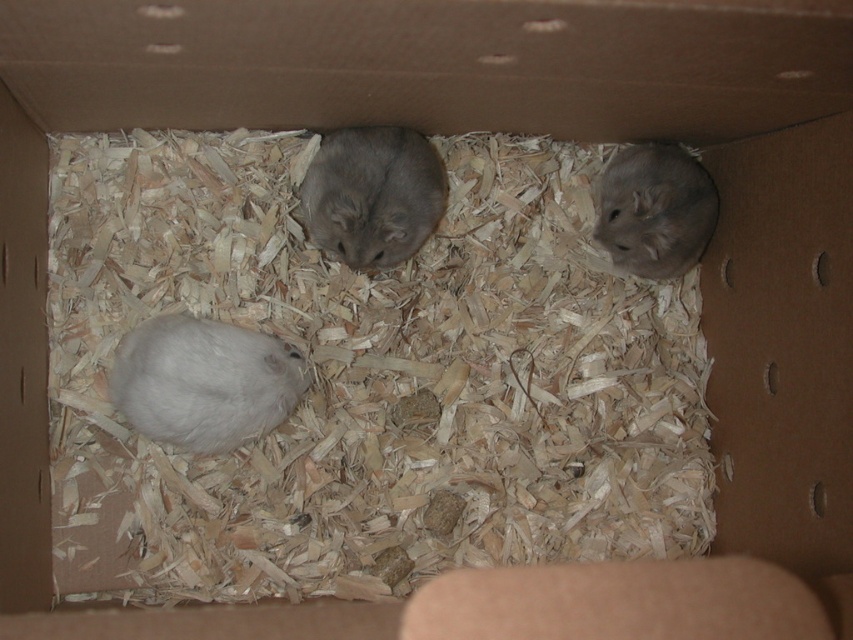
Measure the distance between white fluffy mouse at lower left and camera.

The distance of white fluffy mouse at lower left from camera is 3.87 feet.

Can you confirm if white fluffy mouse at lower left is taller than gray soft fur hamster at center?

Incorrect, white fluffy mouse at lower left's height is not larger of gray soft fur hamster at center's.

Does point (195, 365) come closer to viewer compared to point (339, 205)?

Yes, point (195, 365) is in front of point (339, 205).

In order to click on white fluffy mouse at lower left in this screenshot , I will do `click(204, 381)`.

Is point (138, 429) behind point (664, 275)?

No, (138, 429) is in front of (664, 275).

Does white fluffy mouse at lower left have a greater height compared to gray soft fur hamster at right?

Incorrect, white fluffy mouse at lower left's height is not larger of gray soft fur hamster at right's.

Between point (235, 372) and point (601, 209), which one is positioned behind?

Positioned behind is point (601, 209).

Find the location of `white fluffy mouse at lower left`. white fluffy mouse at lower left is located at coordinates (204, 381).

Looking at this image, is gray soft fur hamster at center shorter than gray soft fur hamster at right?

Yes, gray soft fur hamster at center is shorter than gray soft fur hamster at right.

Is gray soft fur hamster at center to the left of gray soft fur hamster at right from the viewer's perspective?

Correct, you'll find gray soft fur hamster at center to the left of gray soft fur hamster at right.

Find the location of a particular element. The height and width of the screenshot is (640, 853). gray soft fur hamster at center is located at coordinates (372, 195).